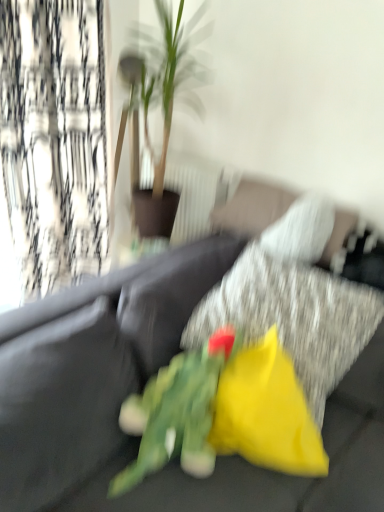
Question: Is green leafy plant at center further to camera compared to yellow fabric pillow at center?

Choices:
 (A) yes
 (B) no

Answer: (A)

Question: From a real-world perspective, is green leafy plant at center on yellow fabric pillow at center?

Choices:
 (A) no
 (B) yes

Answer: (B)

Question: Can you confirm if green leafy plant at center is thinner than yellow fabric pillow at center?

Choices:
 (A) yes
 (B) no

Answer: (B)

Question: Is the surface of green leafy plant at center in direct contact with yellow fabric pillow at center?

Choices:
 (A) yes
 (B) no

Answer: (B)

Question: Does green leafy plant at center have a smaller size compared to yellow fabric pillow at center?

Choices:
 (A) yes
 (B) no

Answer: (A)

Question: Does green leafy plant at center come in front of yellow fabric pillow at center?

Choices:
 (A) no
 (B) yes

Answer: (A)

Question: From a real-world perspective, is velvet dark gray couch at center positioned over black textured curtain at left based on gravity?

Choices:
 (A) no
 (B) yes

Answer: (A)

Question: Does velvet dark gray couch at center have a lesser width compared to black textured curtain at left?

Choices:
 (A) yes
 (B) no

Answer: (B)

Question: Considering the relative sizes of velvet dark gray couch at center and black textured curtain at left in the image provided, is velvet dark gray couch at center wider than black textured curtain at left?

Choices:
 (A) yes
 (B) no

Answer: (A)

Question: Can you confirm if velvet dark gray couch at center is positioned to the right of black textured curtain at left?

Choices:
 (A) yes
 (B) no

Answer: (A)

Question: Is velvet dark gray couch at center shorter than black textured curtain at left?

Choices:
 (A) yes
 (B) no

Answer: (A)

Question: Considering the relative sizes of velvet dark gray couch at center and black textured curtain at left in the image provided, is velvet dark gray couch at center smaller than black textured curtain at left?

Choices:
 (A) no
 (B) yes

Answer: (A)

Question: Is green fabric flower at center wider than black textured curtain at left?

Choices:
 (A) no
 (B) yes

Answer: (B)